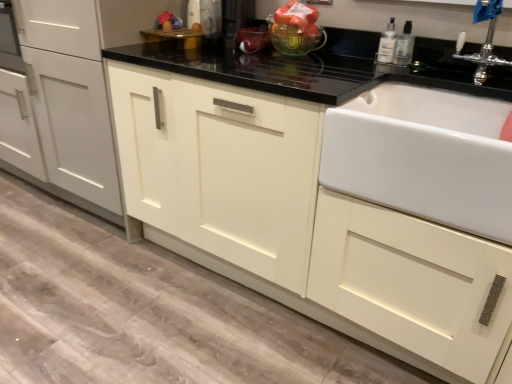
Question: Would you say silver metallic faucet at upper right is to the left or to the right of clear plastic bottle at upper right, positioned as the 1th bottle in left-to-right order, in the picture?

Choices:
 (A) left
 (B) right

Answer: (B)

Question: Considering the positions of silver metallic faucet at upper right and clear plastic bottle at upper right, positioned as the 1th bottle in left-to-right order, in the image, is silver metallic faucet at upper right bigger or smaller than clear plastic bottle at upper right, positioned as the 1th bottle in left-to-right order,?

Choices:
 (A) small
 (B) big

Answer: (B)

Question: Estimate the real-world distances between objects in this image. Which object is farther from the matte white cabinet at center, which ranks as the 2th cabinetry in right-to-left order?

Choices:
 (A) clear plastic bottle at upper right, which is the second bottle from left to right
 (B) silver metallic faucet at upper right
 (C) white ceramic sink at right
 (D) clear plastic bottle at upper right, the second bottle when ordered from right to left
 (E) translucent glass bowl at upper center

Answer: (B)

Question: Which of these objects is positioned farthest from the clear plastic bottle at upper right, which is the second bottle from left to right?

Choices:
 (A) matte white cabinet at center, which ranks as the 1th cabinetry in left-to-right order
 (B) silver metallic faucet at upper right
 (C) clear plastic bottle at upper right, positioned as the 1th bottle in left-to-right order
 (D) white ceramic sink at right
 (E) matte white cabinet at center, the second cabinetry when ordered from left to right

Answer: (A)